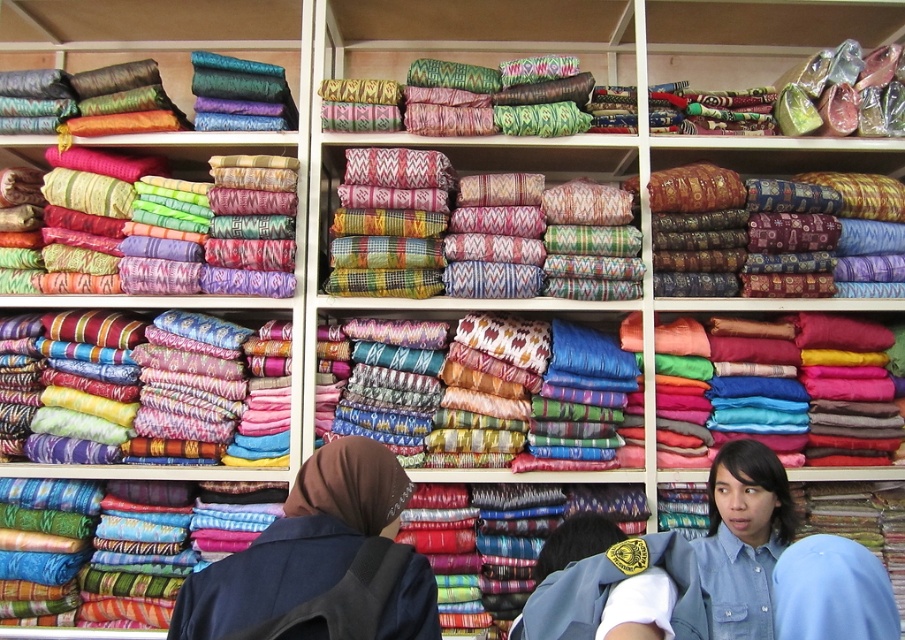
Question: Can you confirm if matte silk scarf at center is thinner than dark blue fabric at lower left?

Choices:
 (A) yes
 (B) no

Answer: (B)

Question: Which object appears closest to the camera in this image?

Choices:
 (A) matte silk scarf at center
 (B) dark blue fabric at lower left

Answer: (B)

Question: Is matte silk scarf at center positioned in front of dark blue fabric at lower left?

Choices:
 (A) no
 (B) yes

Answer: (A)

Question: Can you confirm if matte silk scarf at center is smaller than dark blue fabric at lower left?

Choices:
 (A) no
 (B) yes

Answer: (B)

Question: Which point appears farthest from the camera in this image?

Choices:
 (A) (256, 604)
 (B) (868, 384)

Answer: (B)